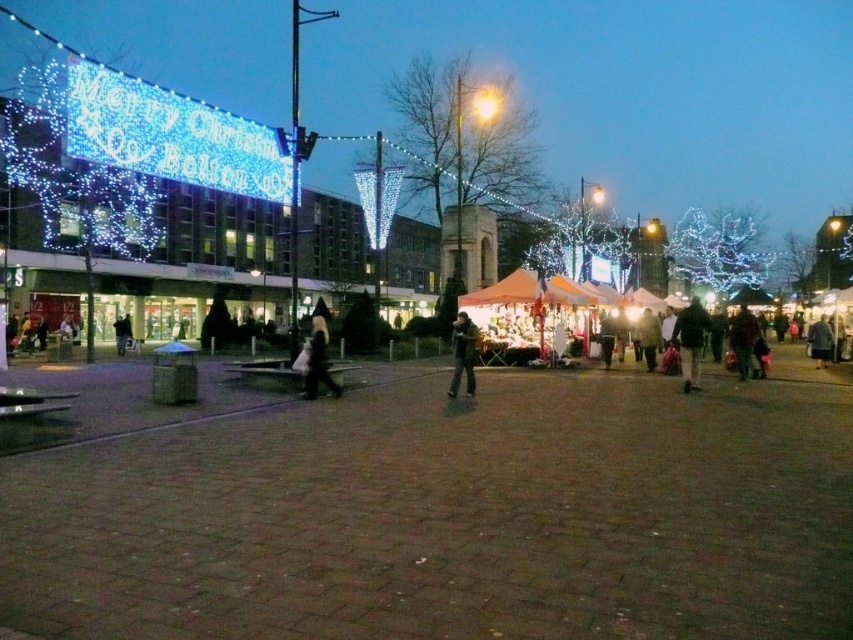
Question: Among these points, which one is farthest from the camera?

Choices:
 (A) (654, 320)
 (B) (813, 330)
 (C) (746, 339)

Answer: (B)

Question: Is dark gray fabric coat at center bigger than dark gray jacket at center?

Choices:
 (A) yes
 (B) no

Answer: (A)

Question: Which object is the farthest from the dark brown leather jacket at lower right?

Choices:
 (A) dark brown coat at center
 (B) orange fabric canopy at center
 (C) dark gray jacket at center

Answer: (B)

Question: From the image, what is the correct spatial relationship of orange fabric canopy at center in relation to dark brown leather jacket at lower right?

Choices:
 (A) below
 (B) above

Answer: (B)

Question: Which object is closer to the camera taking this photo?

Choices:
 (A) dark gray fabric coat at center
 (B) dark brown leather jacket at lower right
 (C) orange fabric canopy at center

Answer: (A)

Question: Does dark brown leather jacket at lower right appear on the right side of dark brown leather jacket at center?

Choices:
 (A) no
 (B) yes

Answer: (A)